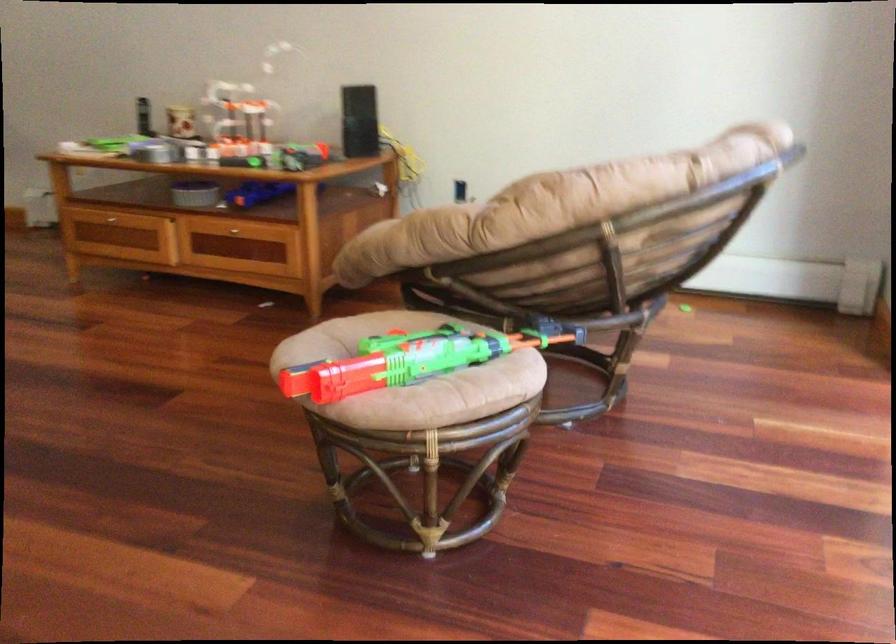
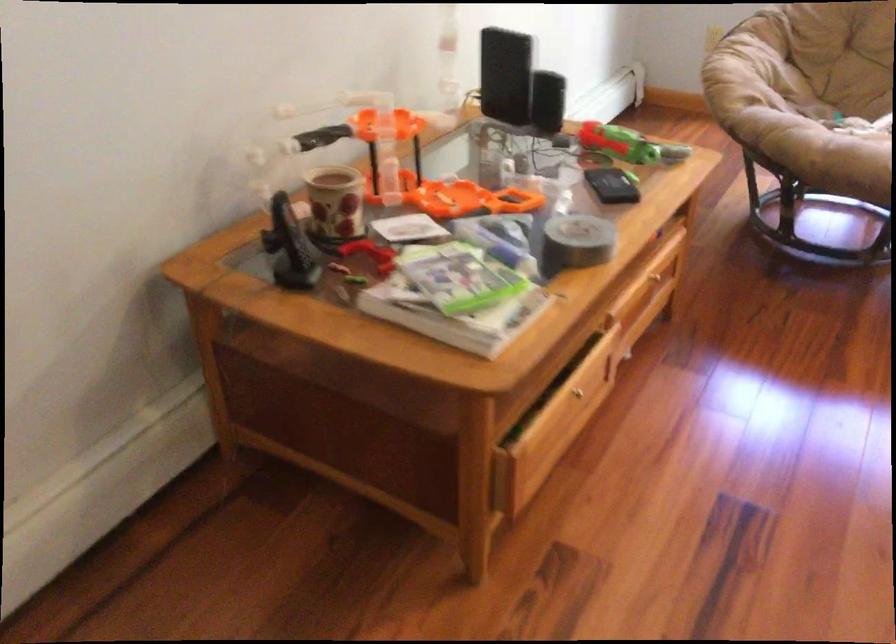
Locate, in the second image, the point that corresponds to pixel 119 142 in the first image.

(459, 277)